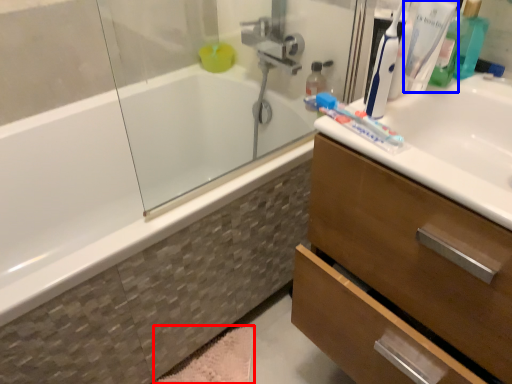
Question: Which of the following is the farthest to the observer, bath mat (highlighted by a red box) or toothbrush (highlighted by a blue box)?

Choices:
 (A) bath mat
 (B) toothbrush

Answer: (A)